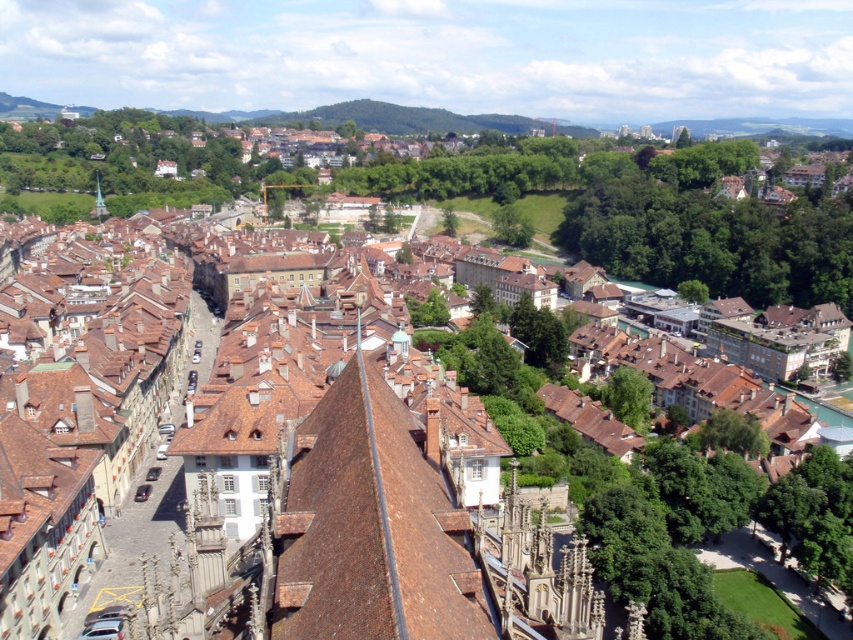
From the picture: Does brown tile roof at center lie behind green wooden tower at center?

No, brown tile roof at center is in front of green wooden tower at center.

Does brown tile roof at center have a greater height compared to green wooden tower at center?

In fact, brown tile roof at center may be shorter than green wooden tower at center.

Is point (334, 596) behind point (97, 173)?

No, it is in front of (97, 173).

In order to click on brown tile roof at center in this screenshot , I will do `click(373, 525)`.